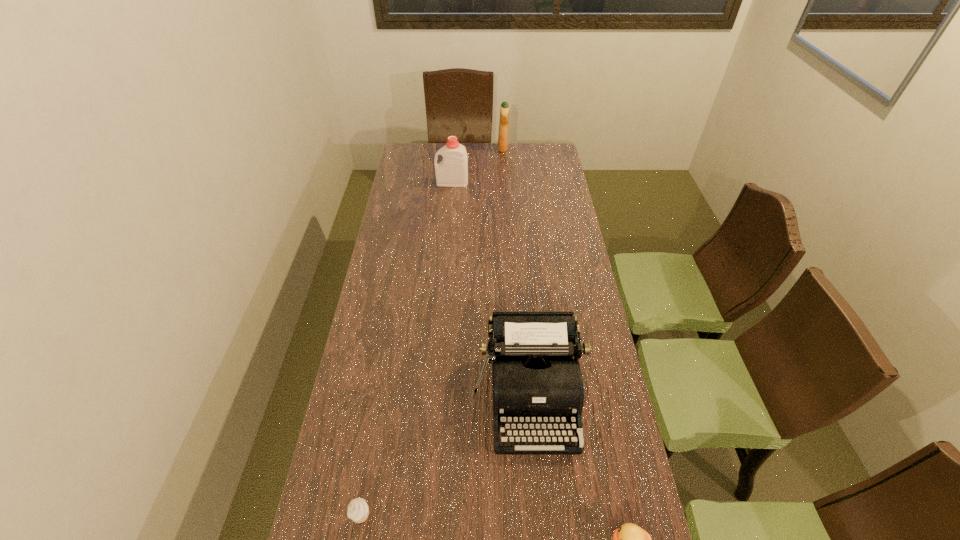
Where is `free spot located on the label of the farther detergent`? Image resolution: width=960 pixels, height=540 pixels. free spot located on the label of the farther detergent is located at coordinates (421, 148).

What are the coordinates of `vacant space located 0.140m on the handle side of the fourth object from right to left` in the screenshot? It's located at (406, 183).

Where is `vacant region located 0.080m on the handle side of the fourth object from right to left`? Image resolution: width=960 pixels, height=540 pixels. vacant region located 0.080m on the handle side of the fourth object from right to left is located at coordinates click(x=420, y=183).

Where is `vacant space situated on the typing side of the typewriter`? vacant space situated on the typing side of the typewriter is located at coordinates (540, 509).

Where is `object located at the far edge`? object located at the far edge is located at coordinates (503, 145).

Where is `object that is at the left edge`? This screenshot has width=960, height=540. object that is at the left edge is located at coordinates (358, 510).

Locate an element on the screen. This screenshot has width=960, height=540. object located in the right edge section of the desktop is located at coordinates (536, 377).

The width and height of the screenshot is (960, 540). I want to click on free location at the far edge of the desktop, so click(496, 160).

The image size is (960, 540). In order to click on vacant space at the left edge of the desktop in this screenshot , I will do `click(397, 223)`.

This screenshot has height=540, width=960. In the image, there is a desktop. What are the coordinates of `free region at the right edge` in the screenshot? It's located at (589, 393).